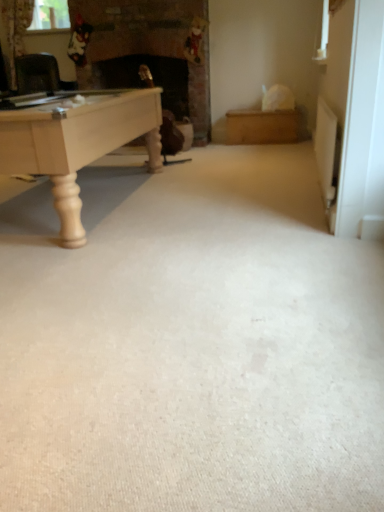
Locate an element on the screen. The height and width of the screenshot is (512, 384). beige carpet at center is located at coordinates (191, 343).

This screenshot has height=512, width=384. Describe the element at coordinates (191, 343) in the screenshot. I see `beige carpet at center` at that location.

Image resolution: width=384 pixels, height=512 pixels. I want to click on clear glass window screen at upper left, so click(50, 15).

What do you see at coordinates (50, 15) in the screenshot? I see `clear glass window screen at upper left` at bounding box center [50, 15].

In order to click on beige carpet at center in this screenshot , I will do `click(191, 343)`.

Which object is positioned more to the right, clear glass window screen at upper left or beige carpet at center?

beige carpet at center is more to the right.

Which object is further away from the camera, clear glass window screen at upper left or beige carpet at center?

clear glass window screen at upper left is behind.

Which is in front, point (33, 13) or point (163, 396)?

Point (163, 396)

From the image's perspective, which object appears higher, clear glass window screen at upper left or beige carpet at center?

clear glass window screen at upper left, from the image's perspective.

From a real-world perspective, is clear glass window screen at upper left physically below beige carpet at center?

Incorrect, from a real-world perspective, clear glass window screen at upper left is higher than beige carpet at center.

Which object is wider, clear glass window screen at upper left or beige carpet at center?

With larger width is beige carpet at center.

Between clear glass window screen at upper left and beige carpet at center, which one has less height?

With less height is beige carpet at center.

Is clear glass window screen at upper left smaller than beige carpet at center?

Indeed, clear glass window screen at upper left has a smaller size compared to beige carpet at center.

Does clear glass window screen at upper left contain beige carpet at center?

No.

Is clear glass window screen at upper left placed right next to beige carpet at center?

No, clear glass window screen at upper left is not making contact with beige carpet at center.

Is clear glass window screen at upper left oriented towards beige carpet at center?

No, clear glass window screen at upper left is not oriented towards beige carpet at center.

How different are the orientations of clear glass window screen at upper left and beige carpet at center in degrees?

The facing directions of clear glass window screen at upper left and beige carpet at center are 0.109 degrees apart.

In order to click on plain below the clear glass window screen at upper left (from a real-world perspective) in this screenshot , I will do `click(191, 343)`.

In the image, is beige carpet at center on the left side or the right side of clear glass window screen at upper left?

beige carpet at center is positioned on clear glass window screen at upper left's right side.

Which object is further away from the camera, beige carpet at center or clear glass window screen at upper left?

clear glass window screen at upper left is more distant.

Which point is more distant from viewer, [131,291] or [34,18]?

Point [34,18]

From the image's perspective, is beige carpet at center below clear glass window screen at upper left?

Yes.

From a real-world perspective, is beige carpet at center below clear glass window screen at upper left?

Yes, from a real-world perspective, beige carpet at center is under clear glass window screen at upper left.

Can you confirm if beige carpet at center is thinner than clear glass window screen at upper left?

No, beige carpet at center is not thinner than clear glass window screen at upper left.

Which of these two, beige carpet at center or clear glass window screen at upper left, stands taller?

clear glass window screen at upper left is taller.

Between beige carpet at center and clear glass window screen at upper left, which one has smaller size?

clear glass window screen at upper left is smaller.

Do you think beige carpet at center is within clear glass window screen at upper left, or outside of it?

beige carpet at center is located beyond the bounds of clear glass window screen at upper left.

Are beige carpet at center and clear glass window screen at upper left beside each other?

No, beige carpet at center is not in contact with clear glass window screen at upper left.

Is beige carpet at center aimed at clear glass window screen at upper left?

No.

Can you tell me how much beige carpet at center and clear glass window screen at upper left differ in facing direction?

There is a 0.109-degree angle between the facing directions of beige carpet at center and clear glass window screen at upper left.

Where is `window screen positioned vertically above the beige carpet at center (from a real-world perspective)`? This screenshot has height=512, width=384. window screen positioned vertically above the beige carpet at center (from a real-world perspective) is located at coordinates (50, 15).

The height and width of the screenshot is (512, 384). I want to click on plain located on the right of clear glass window screen at upper left, so click(x=191, y=343).

I want to click on window screen that appears on the left of beige carpet at center, so click(50, 15).